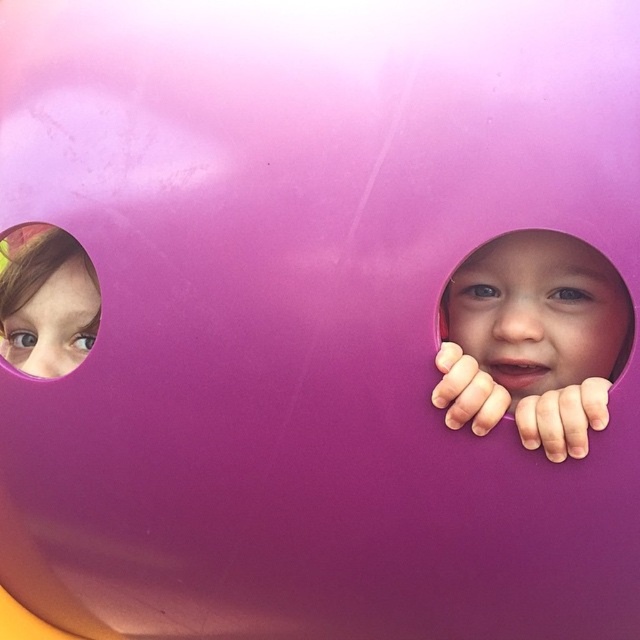
You are a parent trying to locate your child in a playground. You see the matte purple face at right and the pink matte hole at upper left. How far apart are these two features?

The matte purple face at right is 20.31 inches from the pink matte hole at upper left.

You are a photographer trying to capture the children through the circular cutouts in the playground structure. You notice a point labeled at coordinates (532, 339). Based on the scene, which child does this point correspond to?

The point at coordinates (532, 339) indicates the matte purple face at right, so it corresponds to the child on the right.

Where is the matte purple face at right located in the image?

The matte purple face at right is located at point (532, 339) in the image.